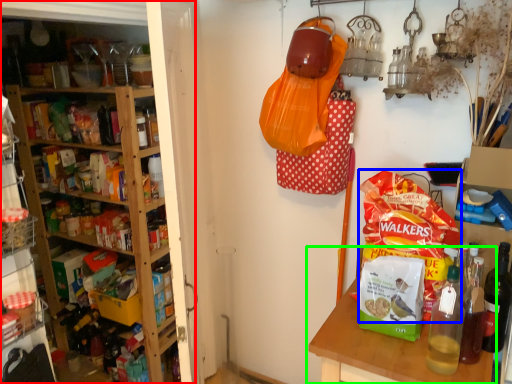
Question: Which object is the farthest from shelf (highlighted by a red box)? Choose among these: snack (highlighted by a blue box) or table (highlighted by a green box).

Choices:
 (A) snack
 (B) table

Answer: (A)